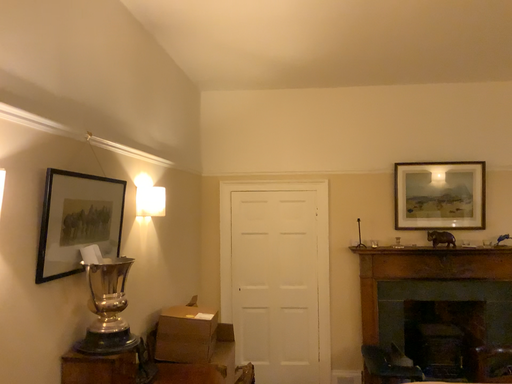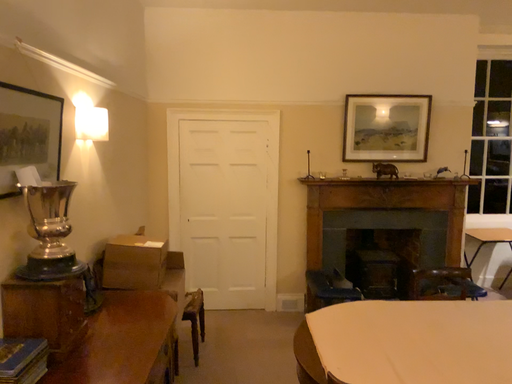
Question: Which way did the camera rotate in the video?

Choices:
 (A) rotated right
 (B) rotated left

Answer: (A)